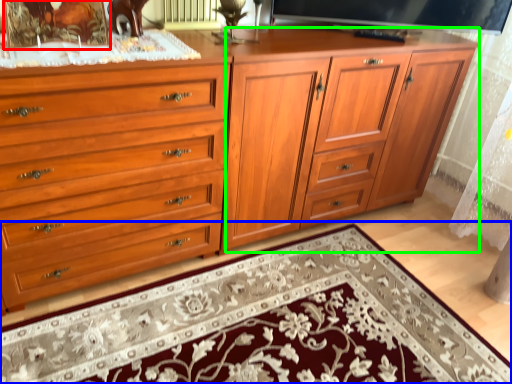
Question: Estimate the real-world distances between objects in this image. Which object is farther from picture frame (highlighted by a red box), mat (highlighted by a blue box) or tv cabinet (highlighted by a green box)?

Choices:
 (A) mat
 (B) tv cabinet

Answer: (A)